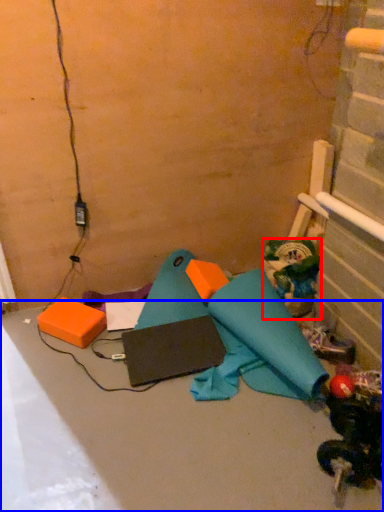
Question: Among these objects, which one is farthest to the camera, toy (highlighted by a red box) or concrete (highlighted by a blue box)?

Choices:
 (A) toy
 (B) concrete

Answer: (A)